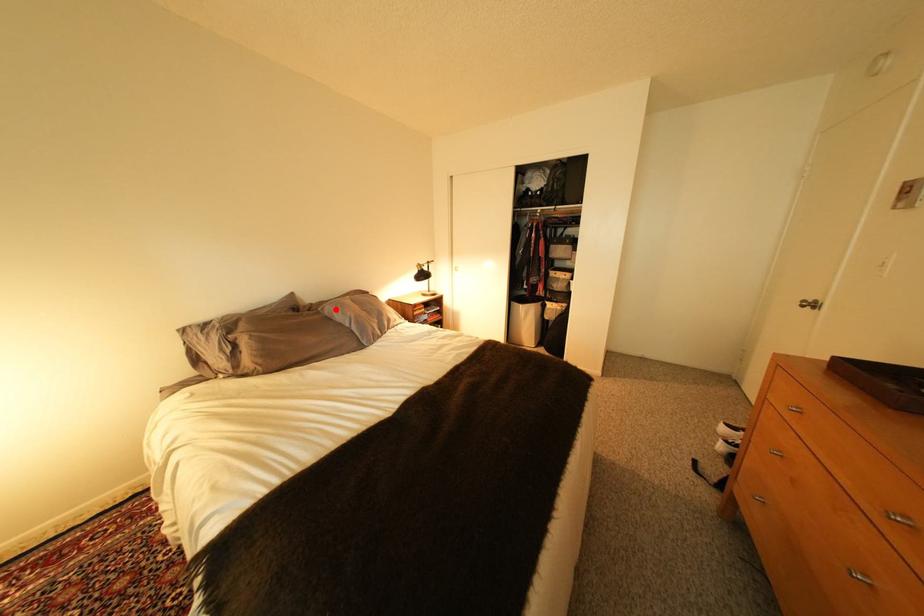
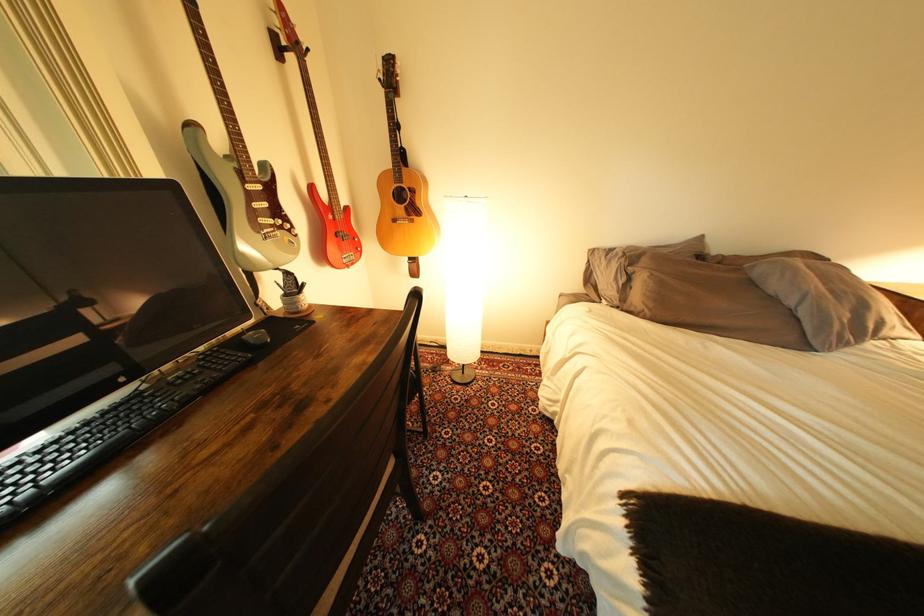
Find the pixel in the second image that matches the highlighted location in the first image.

(767, 268)